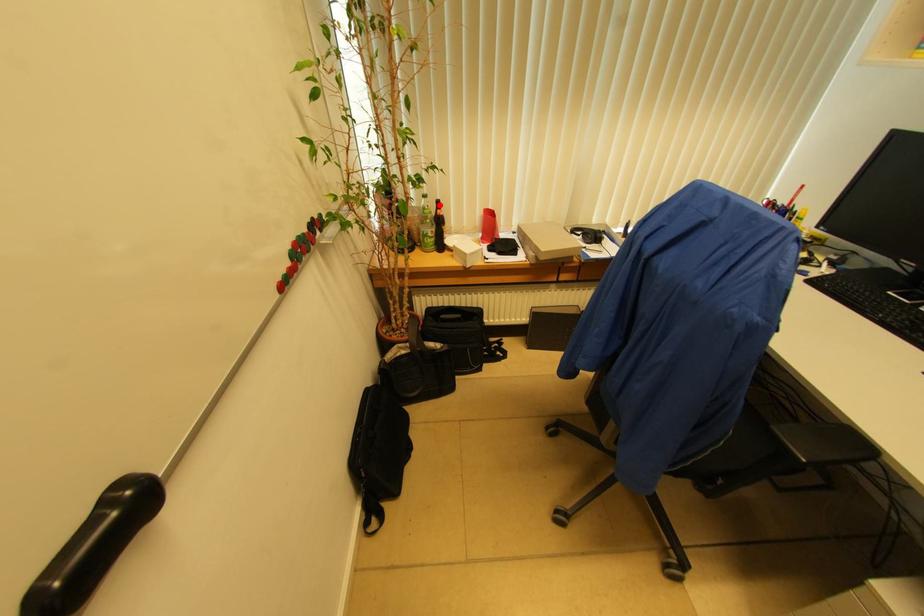
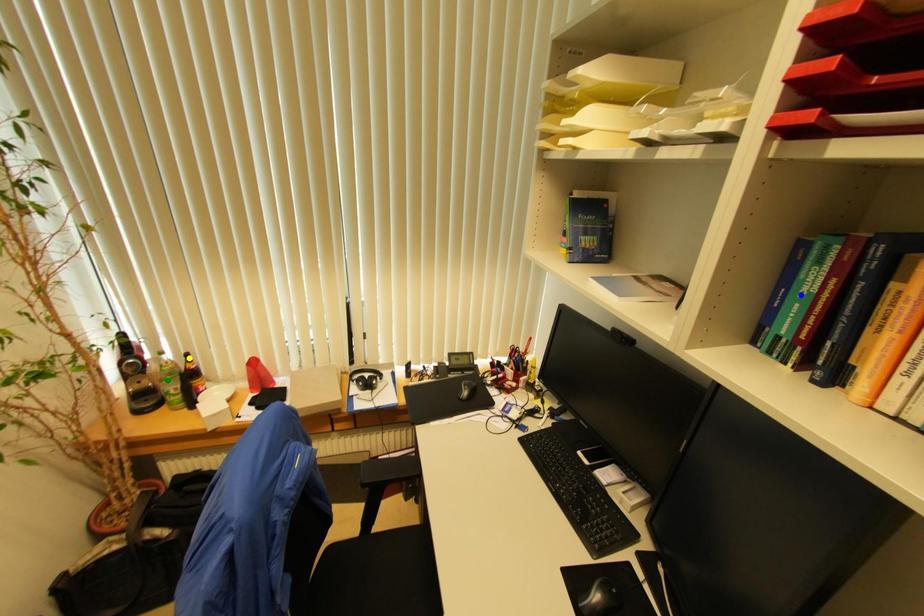
Question: I am providing you with two images of the same scene from different viewpoints. A red point is marked on the first image. You are given multiple points on the second image. Can you choose the point in image 2 that corresponds to the point in image 1?

Choices:
 (A) blue point
 (B) yellow point
 (C) green point

Answer: (B)